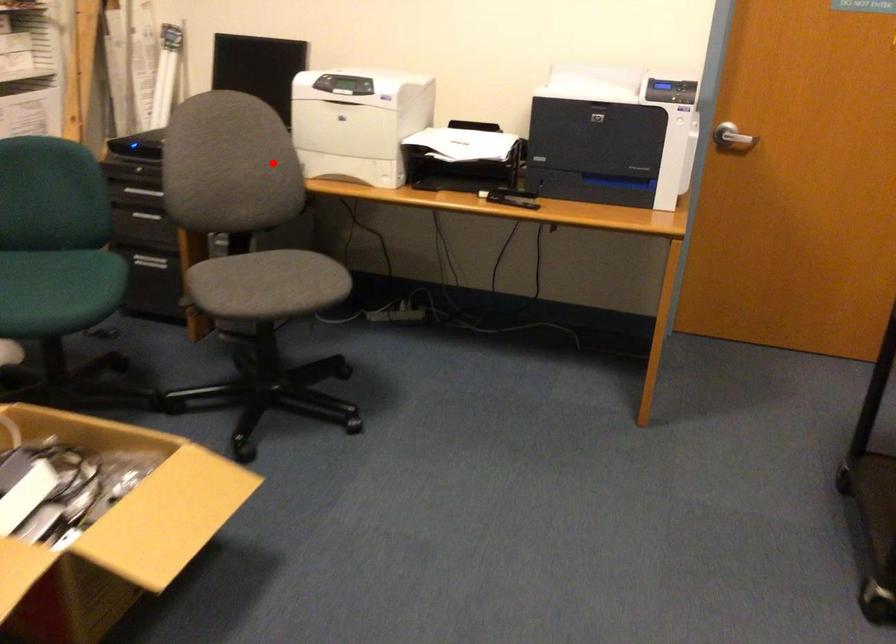
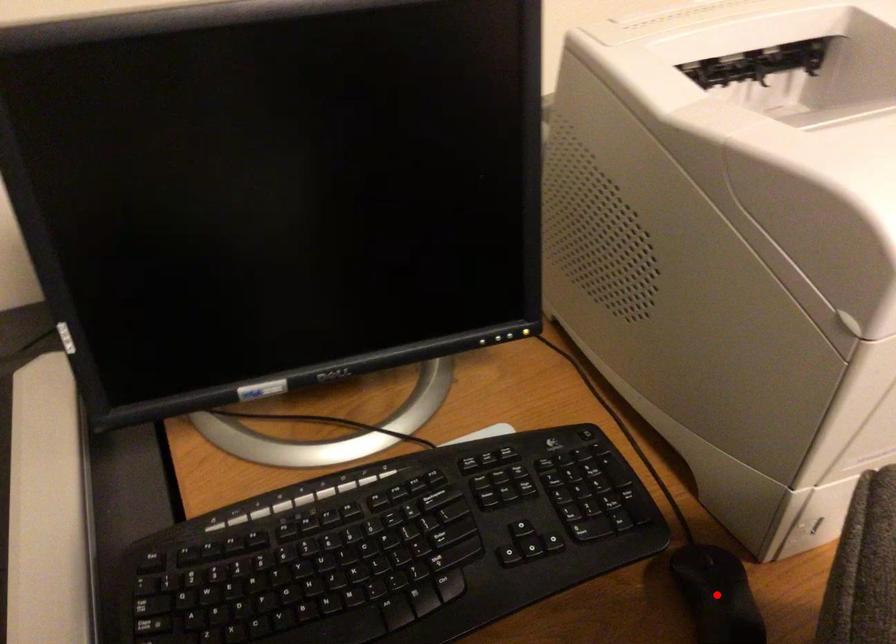
I am providing you with two images of the same scene from different viewpoints. A red point is marked on the first image and another point is marked on the second image. Do the highlighted points in image1 and image2 indicate the same real-world spot?

Yes